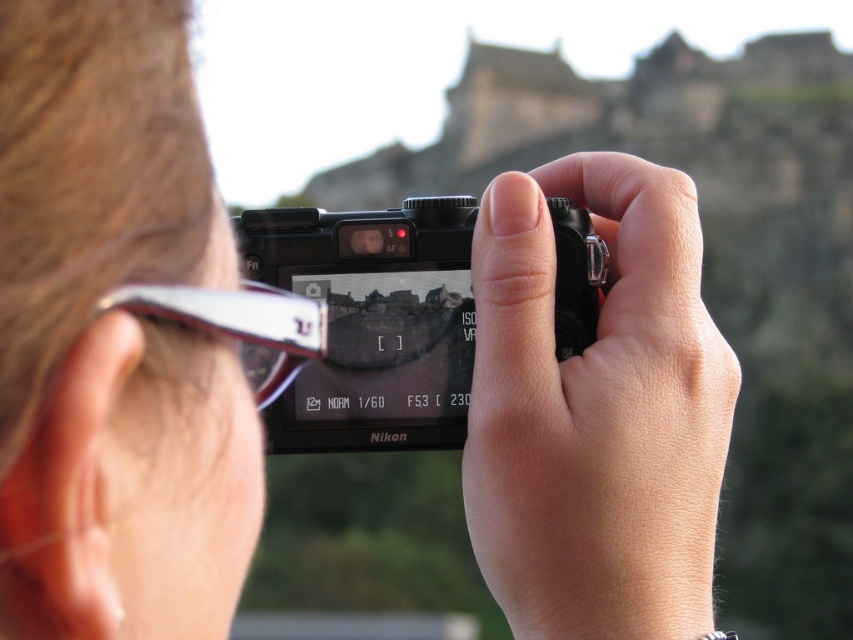
Question: Which point is closer to the camera?

Choices:
 (A) smooth skin hand at center
 (B) clear plastic goggles at upper left

Answer: (B)

Question: Is smooth skin hand at center further to camera compared to clear plastic goggles at upper left?

Choices:
 (A) yes
 (B) no

Answer: (A)

Question: Does black plastic camera at center appear on the right side of clear plastic goggles at upper left?

Choices:
 (A) no
 (B) yes

Answer: (B)

Question: Among these points, which one is nearest to the camera?

Choices:
 (A) (310, 300)
 (B) (350, 404)
 (C) (527, 296)

Answer: (C)

Question: Considering the real-world distances, which object is farthest from the smooth skin hand at center?

Choices:
 (A) black plastic camera at center
 (B) clear plastic goggles at upper left

Answer: (B)

Question: Is smooth skin hand at center thinner than black plastic camera at center?

Choices:
 (A) no
 (B) yes

Answer: (B)